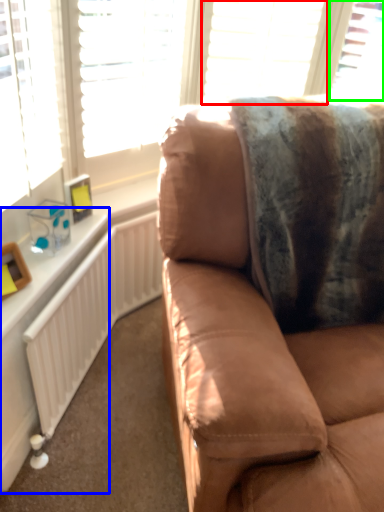
Question: Which object is the farthest from blind (highlighted by a red box)? Choose among these: table (highlighted by a blue box) or window (highlighted by a green box).

Choices:
 (A) table
 (B) window

Answer: (A)